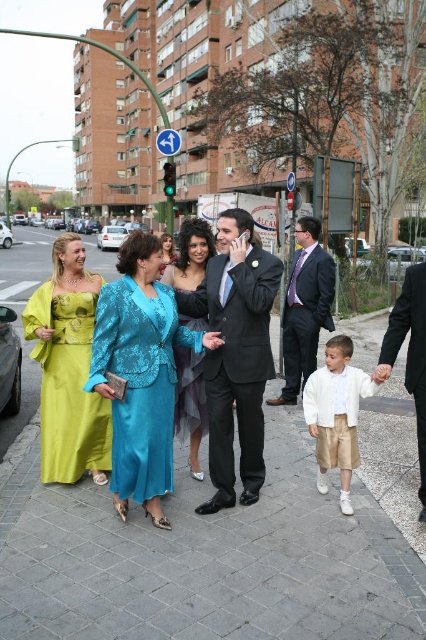
Can you confirm if satin fabric pavement at center is thinner than black satin suit at right?

No.

The image size is (426, 640). Describe the element at coordinates (207, 561) in the screenshot. I see `satin fabric pavement at center` at that location.

Where is `satin fabric pavement at center`? This screenshot has height=640, width=426. satin fabric pavement at center is located at coordinates (207, 561).

How much distance is there between lime satin dress at left and teal satin dress at center?

A distance of 36.30 inches exists between lime satin dress at left and teal satin dress at center.

Can you confirm if lime satin dress at left is positioned to the left of teal satin dress at center?

Yes, lime satin dress at left is to the left of teal satin dress at center.

Between point (60, 342) and point (201, 374), which one is positioned behind?

The point (60, 342) is more distant.

At what (x,y) coordinates should I click in order to perform the action: click on lime satin dress at left. Please return your answer as a coordinate pair (x, y). This screenshot has height=640, width=426. Looking at the image, I should click on (68, 385).

Is shiny black suit at center to the right of teal satin dress at center from the viewer's perspective?

Indeed, shiny black suit at center is positioned on the right side of teal satin dress at center.

Measure the distance between point (224,284) and camera.

They are 4.28 meters apart.

The image size is (426, 640). I want to click on shiny black suit at center, so click(236, 355).